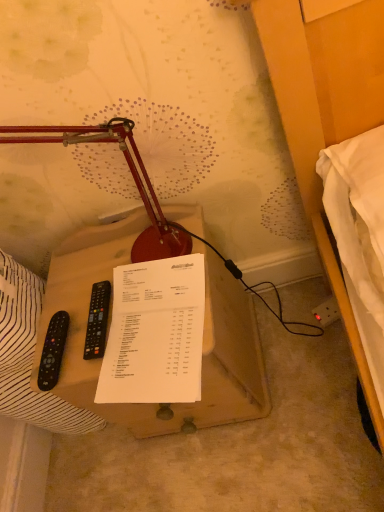
Find the location of `free space to the right of wooden table at center`. free space to the right of wooden table at center is located at coordinates (294, 336).